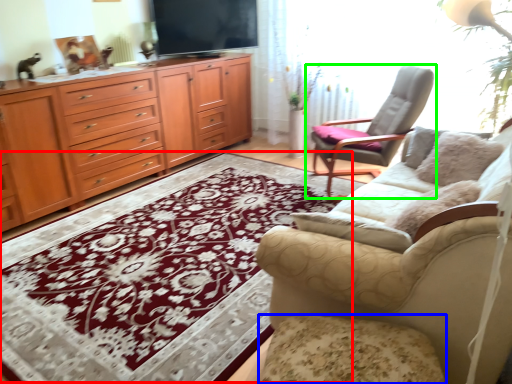
Question: Which object is the farthest from mat (highlighted by a red box)? Choose among these: footrest (highlighted by a blue box) or chair (highlighted by a green box).

Choices:
 (A) footrest
 (B) chair

Answer: (B)